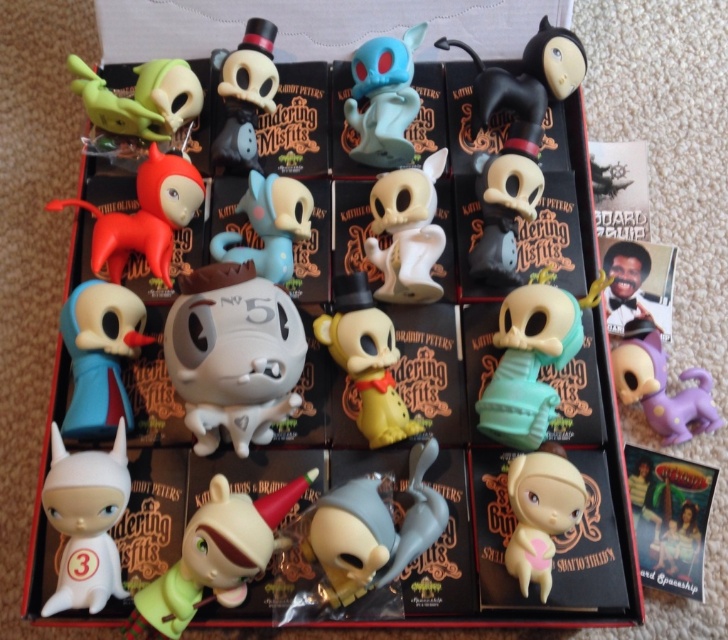
Question: Does white matte figurine at center appear over matte blue rubber duck at lower left?

Choices:
 (A) yes
 (B) no

Answer: (A)

Question: Among these points, which one is nearest to the camera?

Choices:
 (A) (x=662, y=424)
 (B) (x=274, y=80)

Answer: (A)

Question: Estimate the real-world distances between objects in this image. Which object is farther from the matte black figurine at upper center?

Choices:
 (A) matte pink plastic doll at lower right
 (B) yellow matte figurine at center

Answer: (A)

Question: Which object is farther from the camera taking this photo?

Choices:
 (A) matte pink plastic doll at lower right
 (B) teal matte skeleton at center

Answer: (B)

Question: Is teal matte skeleton at center below matte white figurine at center?

Choices:
 (A) no
 (B) yes

Answer: (A)

Question: Where is purple matte dog at lower right located in relation to matte blue figurine at center in the image?

Choices:
 (A) right
 (B) left

Answer: (A)